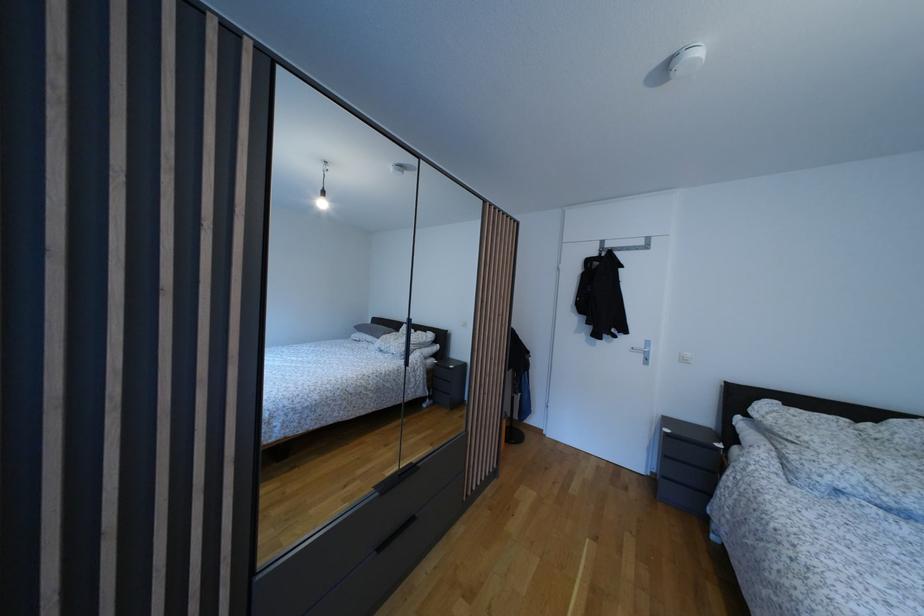
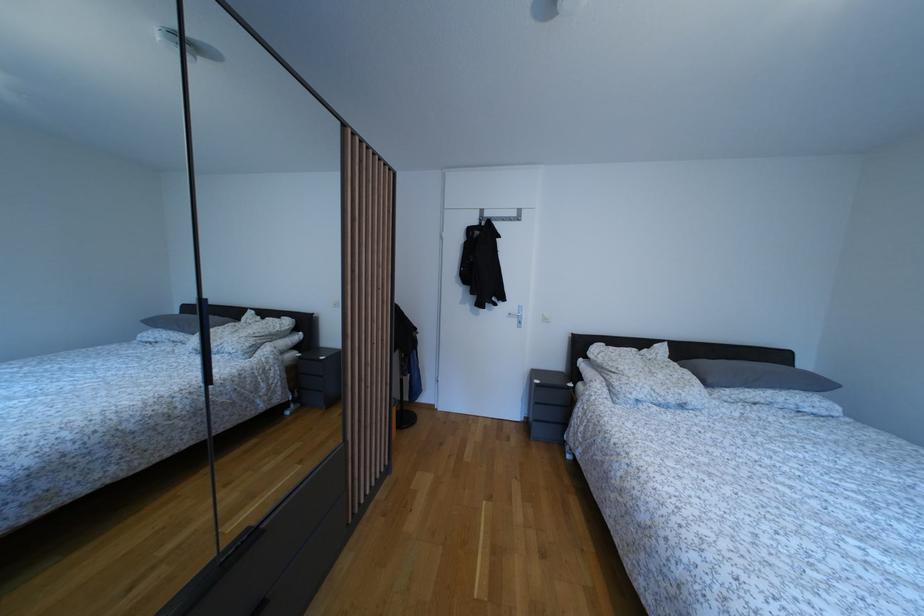
Question: In a continuous first-person perspective shot, in which direction is the camera moving?

Choices:
 (A) Left
 (B) Right
 (C) Forward
 (D) Backward

Answer: (C)